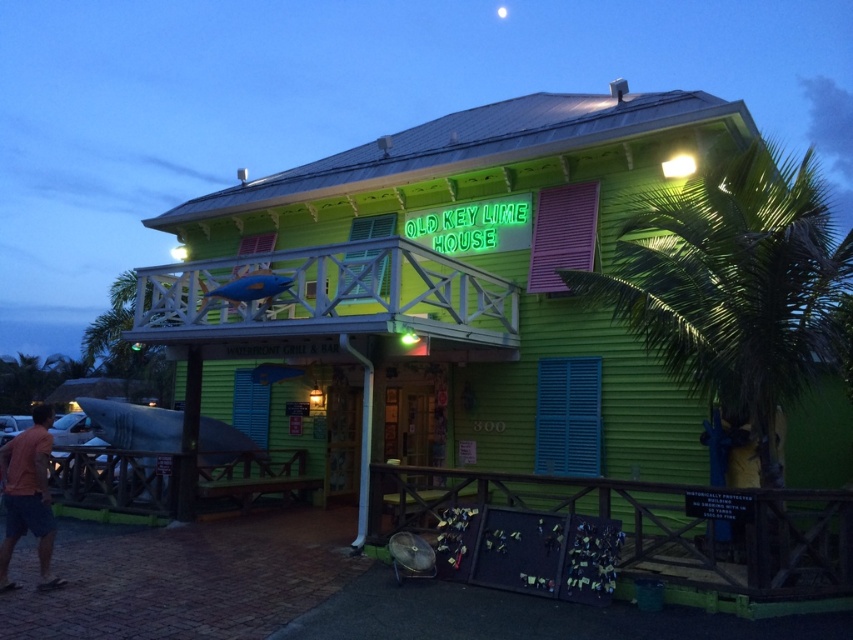
You are standing in front of the Old Key Lime House at dusk. You see a point marked at coordinates (28, 497). What object is located at that point?

The point at coordinates (28, 497) indicates the orange cotton tshirt at lower left.